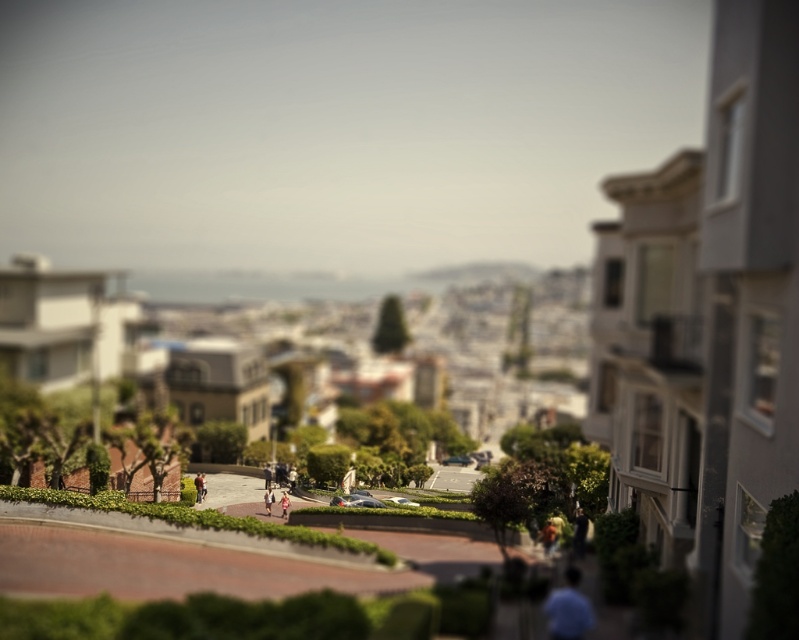
Question: Which point appears farthest from the camera in this image?

Choices:
 (A) (271, 499)
 (B) (197, 492)

Answer: (B)

Question: Is light brown leather jacket at lower right positioned before light pink fabric at center?

Choices:
 (A) no
 (B) yes

Answer: (B)

Question: Which of these objects is positioned farthest from the red shirt at center?

Choices:
 (A) light blue shirt at lower right
 (B) light brown leather jacket at lower right

Answer: (A)

Question: Is red shirt at center to the right of light pink fabric at center from the viewer's perspective?

Choices:
 (A) yes
 (B) no

Answer: (B)

Question: Can you confirm if red shirt at center is positioned below pink fabric dress at center?

Choices:
 (A) yes
 (B) no

Answer: (A)

Question: Which point appears closest to the camera in this image?

Choices:
 (A) (284, 497)
 (B) (581, 524)

Answer: (B)